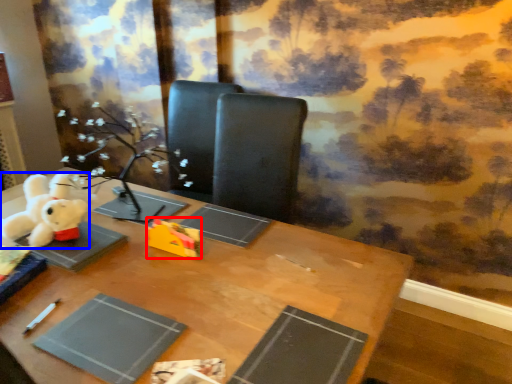
Question: Which object appears farthest to the camera in this image, toy (highlighted by a red box) or toy (highlighted by a blue box)?

Choices:
 (A) toy
 (B) toy

Answer: (A)